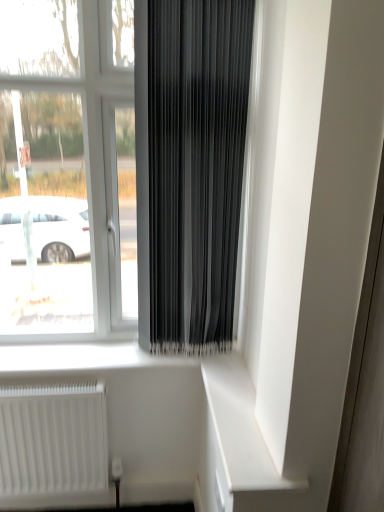
Question: Is there a large distance between transparent glass window at center and white matte radiator at lower left?

Choices:
 (A) no
 (B) yes

Answer: (A)

Question: Is transparent glass window at center closer to camera compared to white matte radiator at lower left?

Choices:
 (A) no
 (B) yes

Answer: (B)

Question: Can you confirm if transparent glass window at center is positioned to the right of white matte radiator at lower left?

Choices:
 (A) no
 (B) yes

Answer: (B)

Question: Is transparent glass window at center at the left side of white matte radiator at lower left?

Choices:
 (A) no
 (B) yes

Answer: (A)

Question: Considering the relative sizes of transparent glass window at center and white matte radiator at lower left in the image provided, is transparent glass window at center bigger than white matte radiator at lower left?

Choices:
 (A) no
 (B) yes

Answer: (B)

Question: Considering the positions of transparent glass window at center and white matte radiator at lower left in the image, is transparent glass window at center wider or thinner than white matte radiator at lower left?

Choices:
 (A) wide
 (B) thin

Answer: (A)

Question: From a real-world perspective, is transparent glass window at center positioned above or below white matte radiator at lower left?

Choices:
 (A) below
 (B) above

Answer: (B)

Question: Is point (76, 162) positioned closer to the camera than point (71, 393)?

Choices:
 (A) farther
 (B) closer

Answer: (A)

Question: Is transparent glass window at center taller or shorter than white matte radiator at lower left?

Choices:
 (A) short
 (B) tall

Answer: (B)

Question: In the image, is white matte radiator at lower left on the left side or the right side of white matte shelf at lower right?

Choices:
 (A) left
 (B) right

Answer: (A)

Question: Considering the positions of white matte radiator at lower left and white matte shelf at lower right in the image, is white matte radiator at lower left taller or shorter than white matte shelf at lower right?

Choices:
 (A) tall
 (B) short

Answer: (A)

Question: Considering the positions of point (14, 420) and point (284, 488), is point (14, 420) closer or farther from the camera than point (284, 488)?

Choices:
 (A) closer
 (B) farther

Answer: (B)

Question: Is white matte radiator at lower left bigger or smaller than white matte shelf at lower right?

Choices:
 (A) small
 (B) big

Answer: (B)

Question: From the image's perspective, is black matte curtain at center above or below transparent glass window at center?

Choices:
 (A) below
 (B) above

Answer: (A)

Question: From a real-world perspective, is black matte curtain at center physically located above or below transparent glass window at center?

Choices:
 (A) below
 (B) above

Answer: (B)